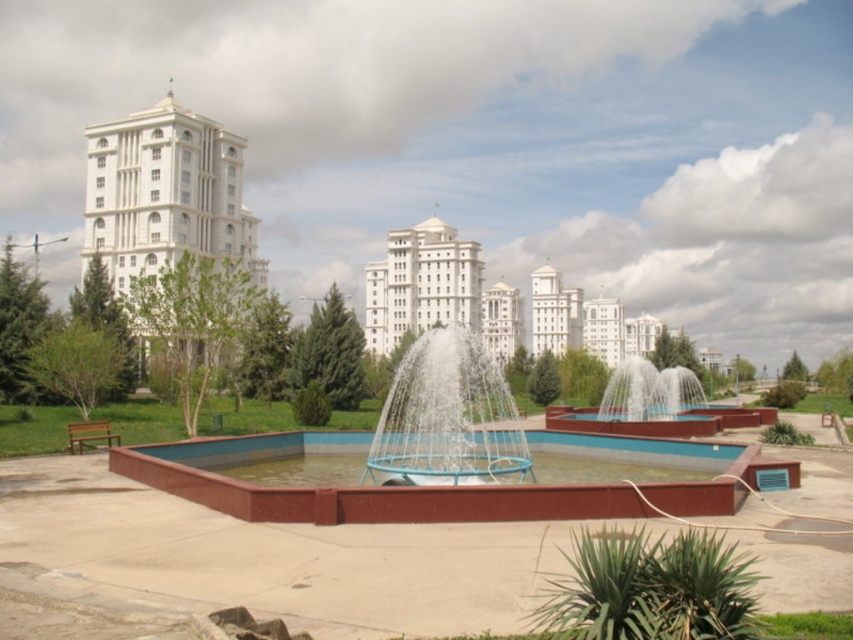
Who is higher up, blue concrete fountain at center or white glossy building at center?

white glossy building at center is above.

Can you confirm if blue concrete fountain at center is positioned to the left of white glossy building at center?

Correct, you'll find blue concrete fountain at center to the left of white glossy building at center.

Where is `blue concrete fountain at center`? The width and height of the screenshot is (853, 640). blue concrete fountain at center is located at coordinates (x=466, y=454).

Does point (131, 253) lie behind point (448, 445)?

Yes.

At what (x,y) coordinates should I click in order to perform the action: click on white glossy building at upper left. Please return your answer as a coordinate pair (x, y). This screenshot has width=853, height=640. Looking at the image, I should click on (165, 195).

Does blue concrete fountain at center have a lesser width compared to white glossy building at upper left?

No, blue concrete fountain at center is not thinner than white glossy building at upper left.

From the picture: Between blue concrete fountain at center and white glossy building at upper left, which one is positioned higher?

white glossy building at upper left is above.

The image size is (853, 640). Identify the location of blue concrete fountain at center. (466, 454).